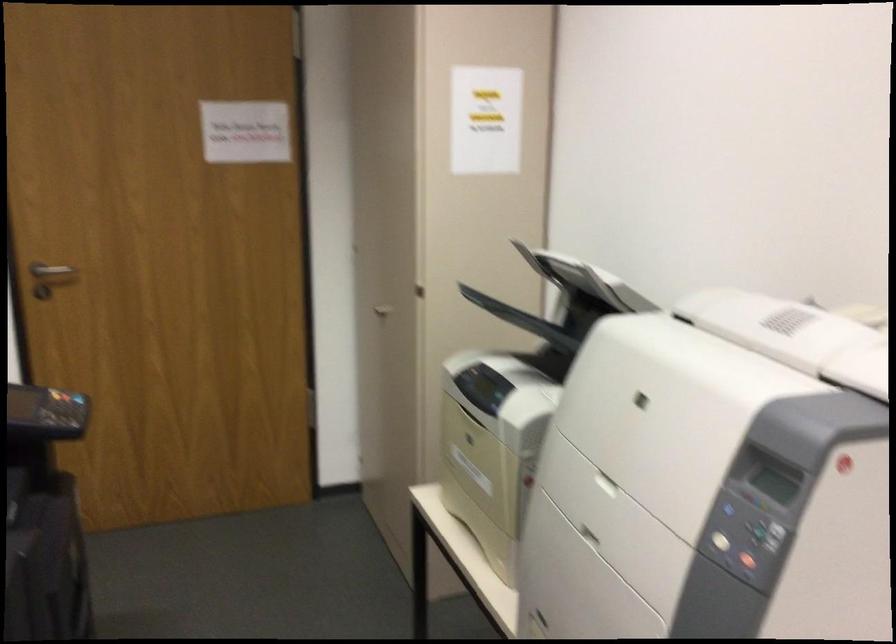
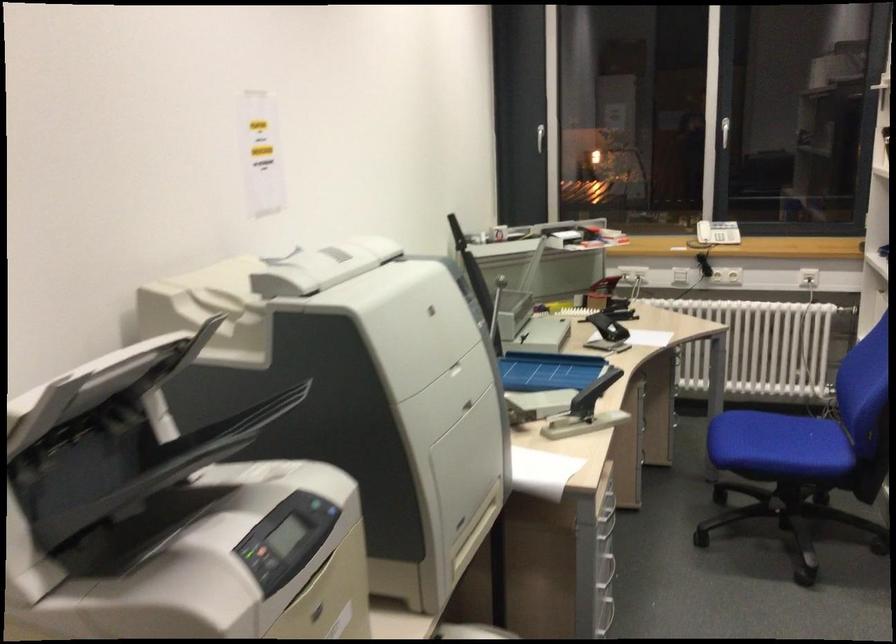
Find the pixel in the second image that matches the point at 636,297 in the first image.

(101, 401)